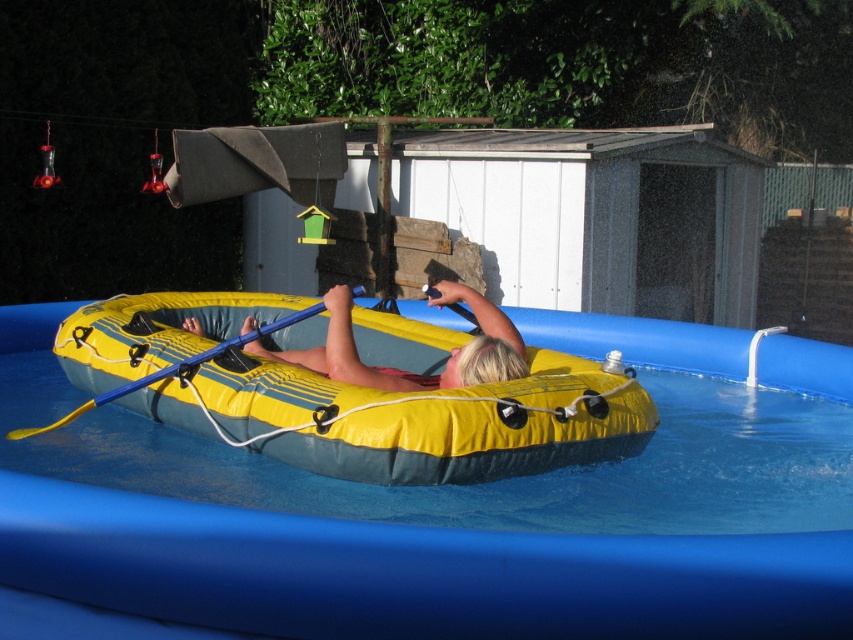
Which is above, blue rubber pool at center or yellow rubber kayak at center?

blue rubber pool at center is higher up.

The width and height of the screenshot is (853, 640). What do you see at coordinates (389, 576) in the screenshot? I see `blue rubber pool at center` at bounding box center [389, 576].

Find the location of `blue rubber pool at center`. blue rubber pool at center is located at coordinates (389, 576).

Can you confirm if blonde hair at upper center is positioned above blue plastic paddle at center?

Yes, blonde hair at upper center is above blue plastic paddle at center.

Does blonde hair at upper center have a greater height compared to blue plastic paddle at center?

In fact, blonde hair at upper center may be shorter than blue plastic paddle at center.

Locate an element on the screen. blonde hair at upper center is located at coordinates (407, 372).

Does blue rubber pool at center have a smaller size compared to blue plastic paddle at center?

Yes, blue rubber pool at center is smaller than blue plastic paddle at center.

Is blue rubber pool at center to the right of blue plastic paddle at center from the viewer's perspective?

Yes, blue rubber pool at center is to the right of blue plastic paddle at center.

Locate an element on the screen. blue rubber pool at center is located at coordinates [x=389, y=576].